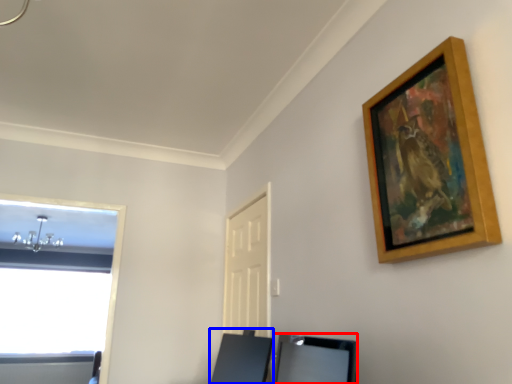
Question: Which object appears farthest to the camera in this image, vanity (highlighted by a red box) or vanity (highlighted by a blue box)?

Choices:
 (A) vanity
 (B) vanity

Answer: (B)